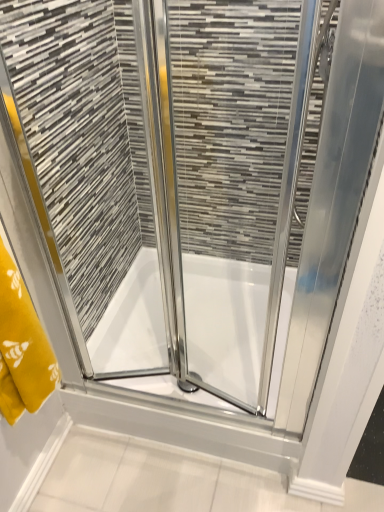
Question: In the image, is white glossy bath at center positioned in front of or behind yellow fabric towel at left?

Choices:
 (A) behind
 (B) front

Answer: (A)

Question: Is white glossy bath at center wider or thinner than yellow fabric towel at left?

Choices:
 (A) wide
 (B) thin

Answer: (A)

Question: Considering the relative positions of white glossy bath at center and yellow fabric towel at left in the image provided, is white glossy bath at center to the left or to the right of yellow fabric towel at left?

Choices:
 (A) left
 (B) right

Answer: (B)

Question: Considering the relative positions of yellow fabric towel at left and white glossy bath at center in the image provided, is yellow fabric towel at left to the left or to the right of white glossy bath at center?

Choices:
 (A) right
 (B) left

Answer: (B)

Question: From a real-world perspective, is yellow fabric towel at left positioned above or below white glossy bath at center?

Choices:
 (A) below
 (B) above

Answer: (B)

Question: Would you say yellow fabric towel at left is inside or outside white glossy bath at center?

Choices:
 (A) inside
 (B) outside

Answer: (B)

Question: Is yellow fabric towel at left bigger or smaller than white glossy bath at center?

Choices:
 (A) small
 (B) big

Answer: (A)